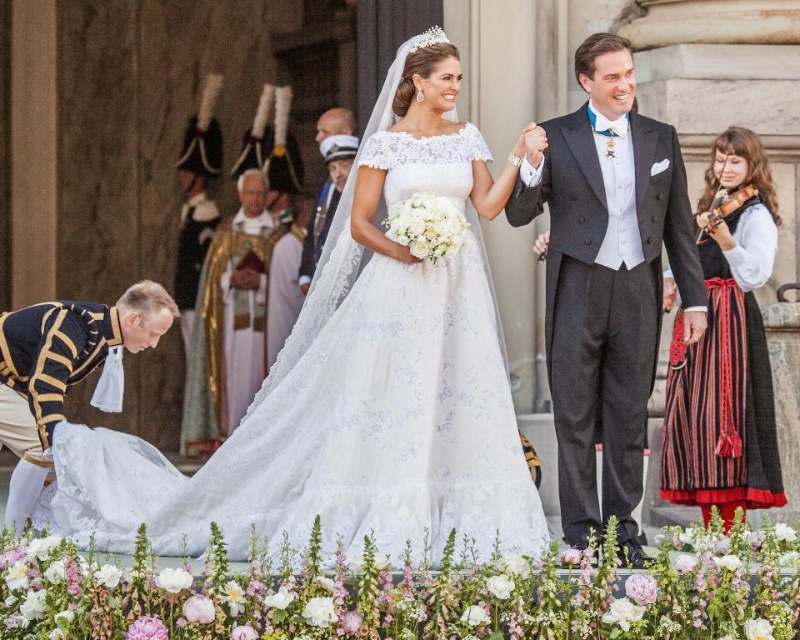
This screenshot has width=800, height=640. What do you see at coordinates (338, 440) in the screenshot?
I see `white lace dress at center` at bounding box center [338, 440].

Between point (344, 508) and point (680, 444), which one is positioned in front?

Point (344, 508) is in front.

Identify the location of white lace dress at center. This screenshot has height=640, width=800. (338, 440).

In the scene shown: Can you confirm if white lace dress at center is wider than smooth black suit at upper right?

Yes, white lace dress at center is wider than smooth black suit at upper right.

Who is more distant from viewer, (410, 360) or (586, 483)?

The point (586, 483) is more distant.

Does point (534, 488) come behind point (594, 156)?

That is False.

Where is `white lace dress at center`? white lace dress at center is located at coordinates pos(338,440).

From the picture: Is smooth black suit at upper right below black woven skirt at right?

Incorrect, smooth black suit at upper right is not positioned below black woven skirt at right.

Where is `smooth black suit at upper right`? The width and height of the screenshot is (800, 640). smooth black suit at upper right is located at coordinates (606, 280).